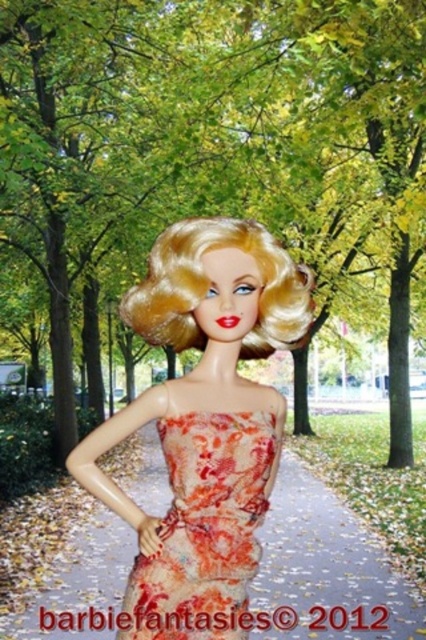
Question: Is matte plastic pavement at center to the left of floral-patterned fabric dress at center from the viewer's perspective?

Choices:
 (A) no
 (B) yes

Answer: (A)

Question: Which object is positioned closest to the shiny plastic doll at center?

Choices:
 (A) floral-patterned fabric dress at center
 (B) matte plastic pavement at center

Answer: (A)

Question: Can you confirm if matte plastic pavement at center is positioned above floral-patterned fabric dress at center?

Choices:
 (A) no
 (B) yes

Answer: (A)

Question: Estimate the real-world distances between objects in this image. Which object is farther from the shiny plastic doll at center?

Choices:
 (A) matte plastic pavement at center
 (B) floral-patterned fabric dress at center

Answer: (A)

Question: Is shiny plastic doll at center thinner than matte plastic pavement at center?

Choices:
 (A) yes
 (B) no

Answer: (A)

Question: Which object appears farthest from the camera in this image?

Choices:
 (A) shiny plastic doll at center
 (B) floral-patterned fabric dress at center
 (C) matte plastic pavement at center

Answer: (C)